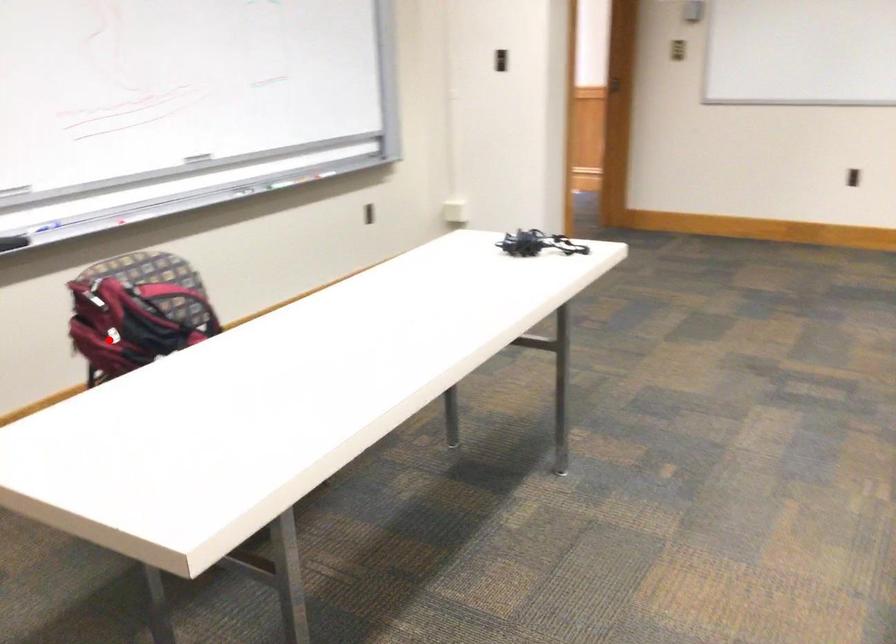
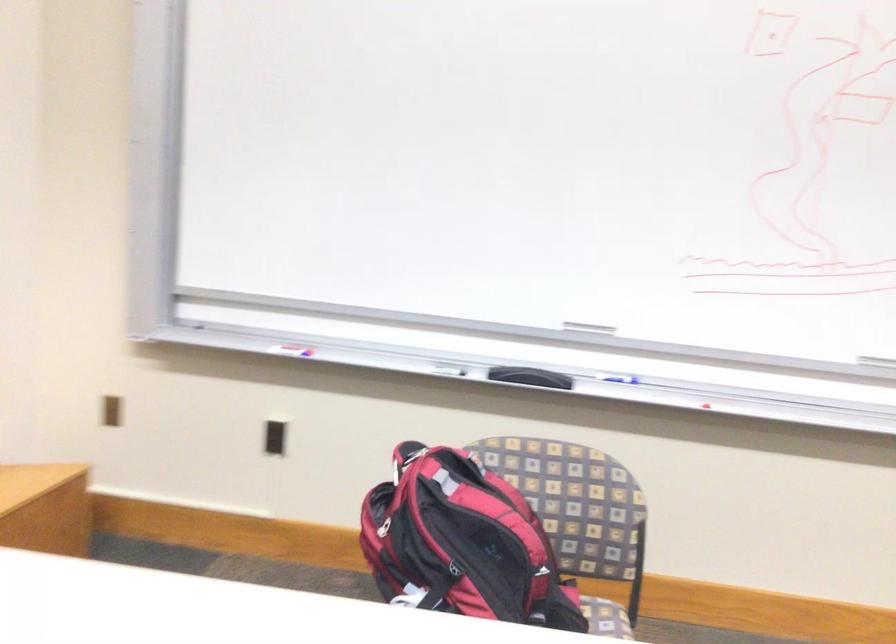
Question: I am providing you with two images of the same scene from different viewpoints. Given a red point in image1, look at the same physical point in image2. Is it:

Choices:
 (A) Closer to the viewpoint
 (B) Farther from the viewpoint

Answer: (A)